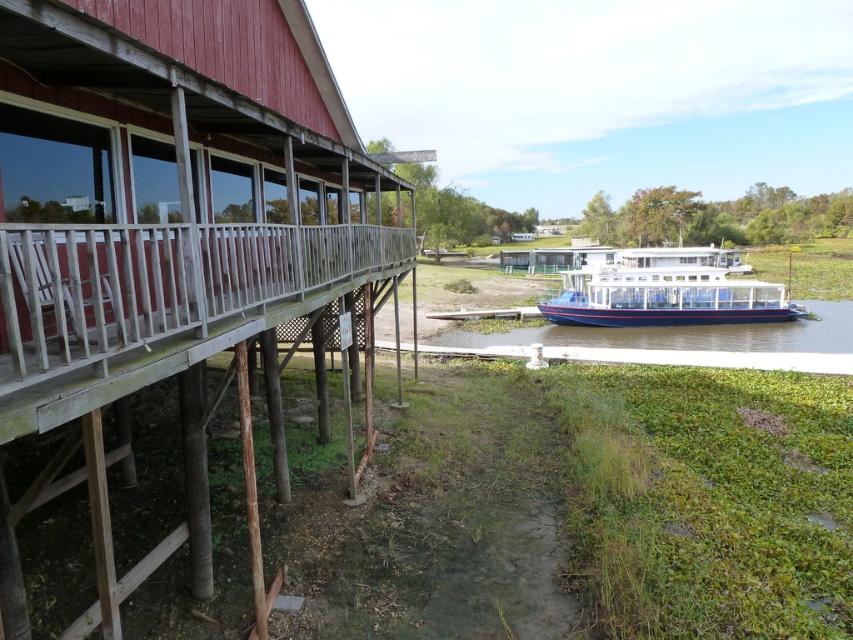
Question: Is wooden dock at left to the left of white glossy boat at center from the viewer's perspective?

Choices:
 (A) no
 (B) yes

Answer: (B)

Question: Is wooden dock at left to the right of white glossy boat at center from the viewer's perspective?

Choices:
 (A) no
 (B) yes

Answer: (A)

Question: Is wooden dock at left smaller than white glossy boat at center?

Choices:
 (A) no
 (B) yes

Answer: (B)

Question: Which point is closer to the camera?

Choices:
 (A) (682, 275)
 (B) (194, 556)

Answer: (B)

Question: Which point appears closest to the camera in this image?

Choices:
 (A) (148, 358)
 (B) (776, 292)

Answer: (A)